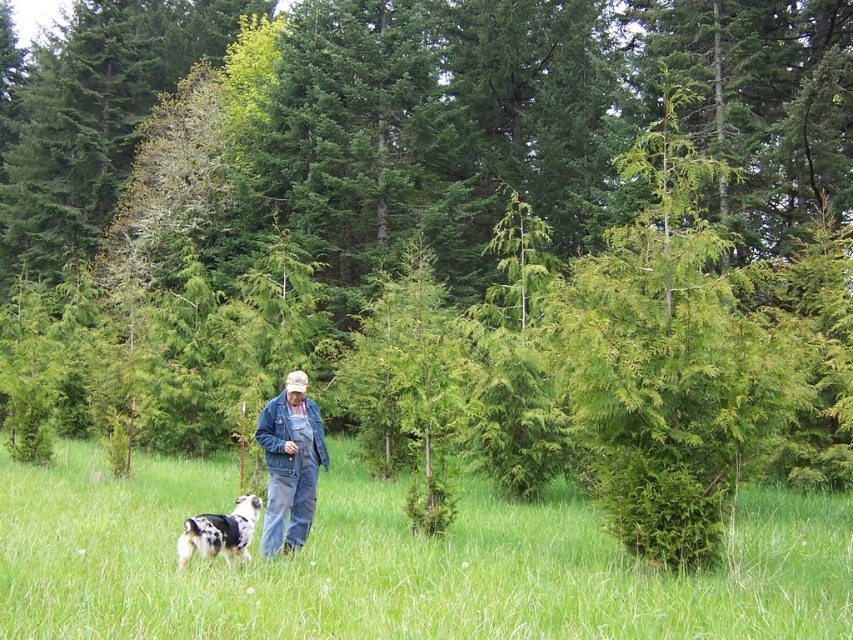
How much distance is there between denim overalls at center and spotted fur dog at lower left?

denim overalls at center is 20.80 inches away from spotted fur dog at lower left.

Measure the distance between denim overalls at center and spotted fur dog at lower left.

denim overalls at center and spotted fur dog at lower left are 20.80 inches apart.

Which is in front, point (308, 406) or point (248, 508)?

Point (248, 508) is more forward.

Image resolution: width=853 pixels, height=640 pixels. Identify the location of denim overalls at center. (289, 465).

Does point (70, 589) come behind point (239, 518)?

No, (70, 589) is closer to viewer.

Can you confirm if green grass at center is taller than spotted fur dog at lower left?

Yes, green grass at center is taller than spotted fur dog at lower left.

Locate an element on the screen. This screenshot has width=853, height=640. green grass at center is located at coordinates (393, 563).

You are a GUI agent. You are given a task and a screenshot of the screen. Output one action in this format:
    pyautogui.click(x=<x>, y=<y>)
    Task: Click on the green grass at center
    
    Given the screenshot: What is the action you would take?
    point(393,563)

Based on the photo, is green grass at center above denim overalls at center?

No, green grass at center is not above denim overalls at center.

Is green grass at center to the left of denim overalls at center from the viewer's perspective?

Incorrect, green grass at center is not on the left side of denim overalls at center.

Who is more forward, [560,509] or [279,483]?

Positioned in front is point [279,483].

Image resolution: width=853 pixels, height=640 pixels. Identify the location of green grass at center. (393, 563).